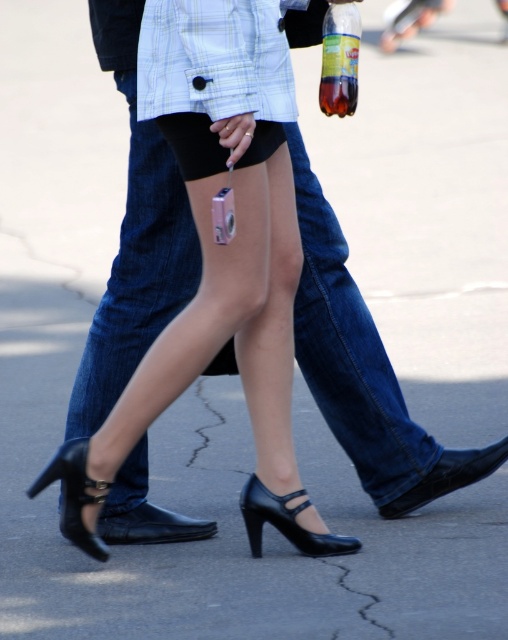
Question: Estimate the real-world distances between objects in this image. Which object is farther from the black patent leather heel at lower center?

Choices:
 (A) black leather heel at lower left
 (B) translucent plastic bottle at center
 (C) black leather shoes at center

Answer: (B)

Question: Which of the following is the closest to the observer?

Choices:
 (A) translucent plastic bottle at center
 (B) black patent leather heel at lower center
 (C) black leather shoes at center

Answer: (C)

Question: Considering the relative positions of black patent leather heel at lower center and translucent plastic bottle at center in the image provided, where is black patent leather heel at lower center located with respect to translucent plastic bottle at center?

Choices:
 (A) left
 (B) right

Answer: (A)

Question: Is black leather heel at lower left positioned behind translucent plastic bottle at center?

Choices:
 (A) yes
 (B) no

Answer: (B)

Question: Estimate the real-world distances between objects in this image. Which object is closer to the translucent plastic bottle at center?

Choices:
 (A) black leather heel at lower left
 (B) black leather shoes at center
 (C) black patent leather heel at lower center

Answer: (B)

Question: Does black leather heel at lower left appear under black patent leather heel at lower center?

Choices:
 (A) yes
 (B) no

Answer: (B)